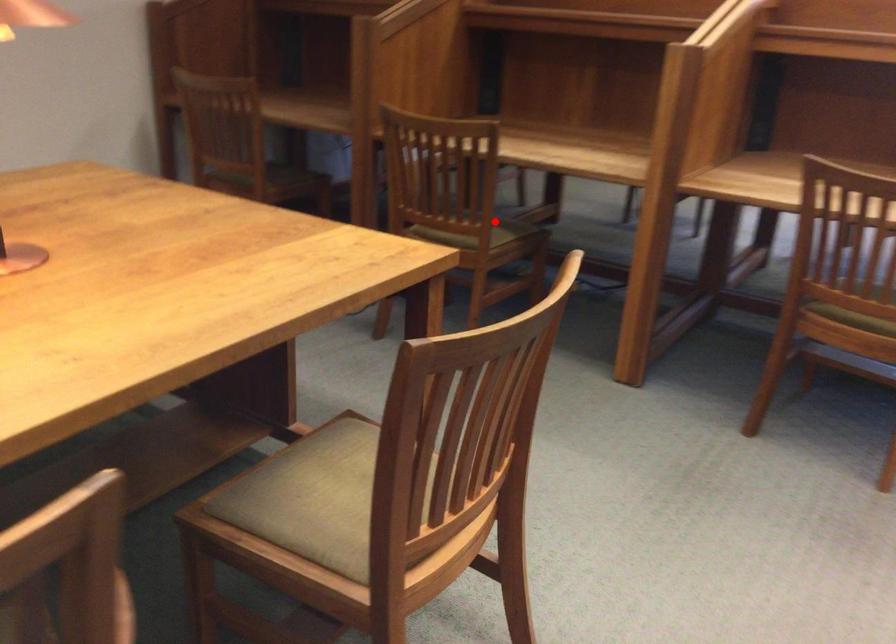
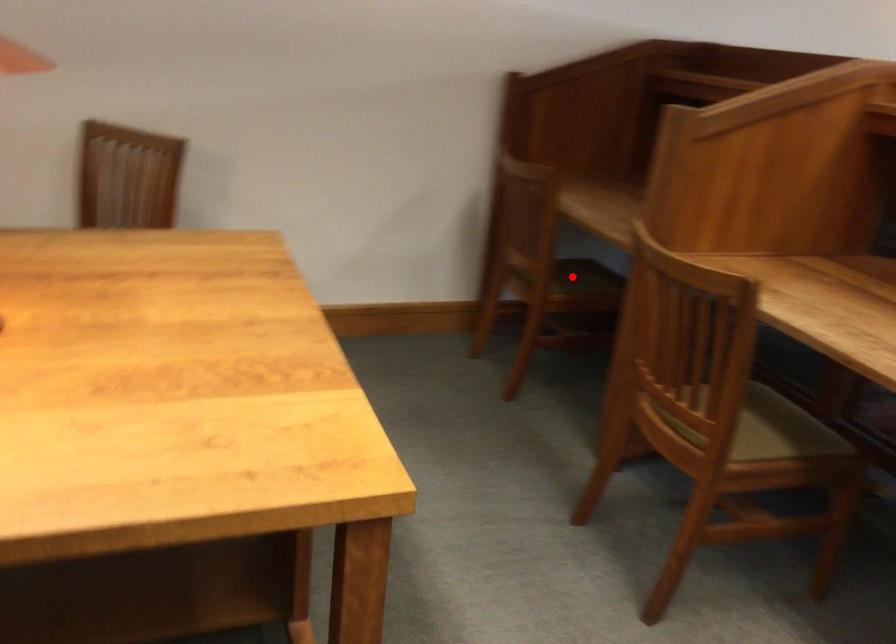
In the scene shown: I am providing you with two images of the same scene from different viewpoints. A red point is marked on the first image and another point is marked on the second image. Is the marked point in image1 the same physical position as the marked point in image2?

No